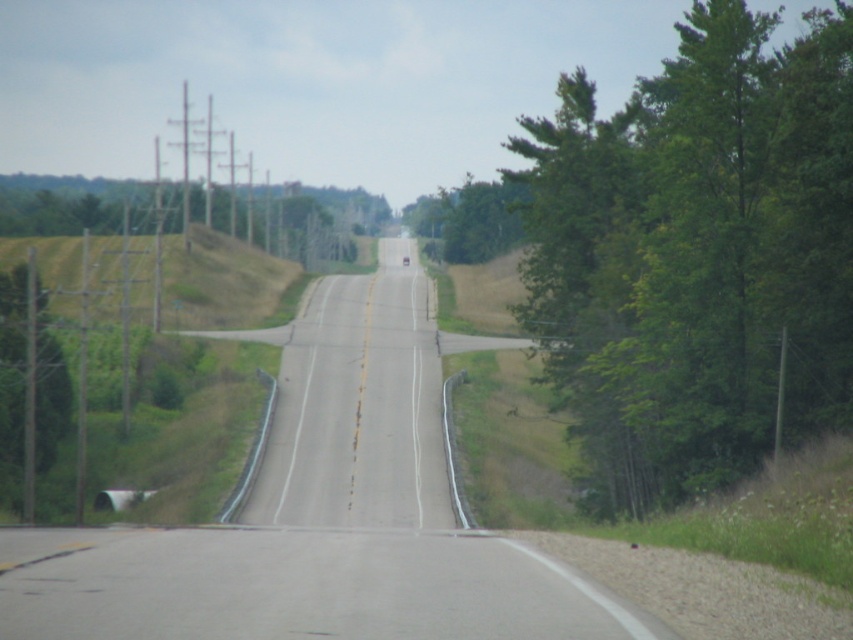
Can you confirm if green leafy tree at right is taller than gray asphalt highway at center?

Yes.

Can you confirm if green leafy tree at right is wider than gray asphalt highway at center?

Correct, the width of green leafy tree at right exceeds that of gray asphalt highway at center.

Locate an element on the screen. green leafy tree at right is located at coordinates (695, 253).

Find the location of a particular element. The image size is (853, 640). green leafy tree at right is located at coordinates (695, 253).

Can you confirm if gray asphalt highway at center is bigger than green leafy tree at left?

Indeed, gray asphalt highway at center has a larger size compared to green leafy tree at left.

Between point (422, 518) and point (0, 388), which one is positioned behind?

Point (0, 388)

The height and width of the screenshot is (640, 853). I want to click on gray asphalt highway at center, so click(357, 404).

Does green leafy tree at right appear on the left side of green leafy tree at left?

No, green leafy tree at right is not to the left of green leafy tree at left.

Does green leafy tree at right have a smaller size compared to green leafy tree at left?

No.

Is point (699, 35) behind point (48, 461)?

No, (699, 35) is closer to viewer.

Find the location of a particular element. The height and width of the screenshot is (640, 853). green leafy tree at right is located at coordinates (695, 253).